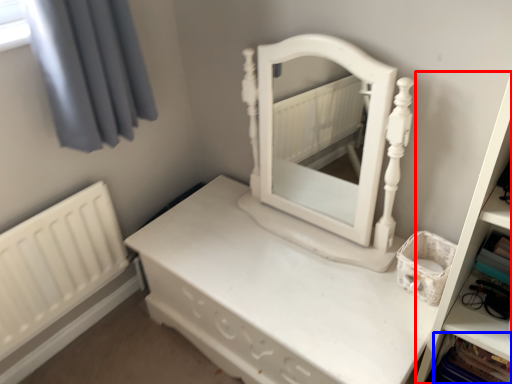
Question: Which object is closer to the camera taking this photo, bookshelf (highlighted by a red box) or cabinet (highlighted by a blue box)?

Choices:
 (A) bookshelf
 (B) cabinet

Answer: (A)